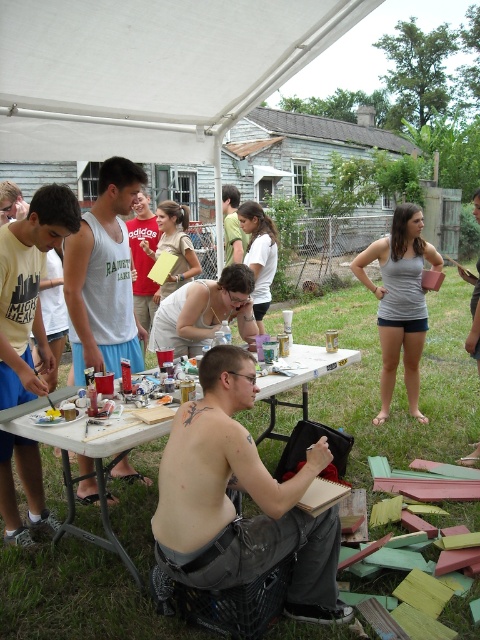
You are a photographer at the event and want to capture a clear shot of the white plastic table at center without the white tank top at center blocking it. Based on their positions, is this possible?

The white plastic table at center is behind the white tank top at center, so it would be blocked. To capture the table clearly, you would need to move around to a position where the tank top is not in front of the table.

You are organizing a community art event and need to ensure that all participants have access to the right clothing. You notice two white tank tops available for use at the event. Which tank top is smaller in size between the matte white tank top at left and the white tank top at center?

The matte white tank top at left is smaller in size compared to the white tank top at center according to the description.